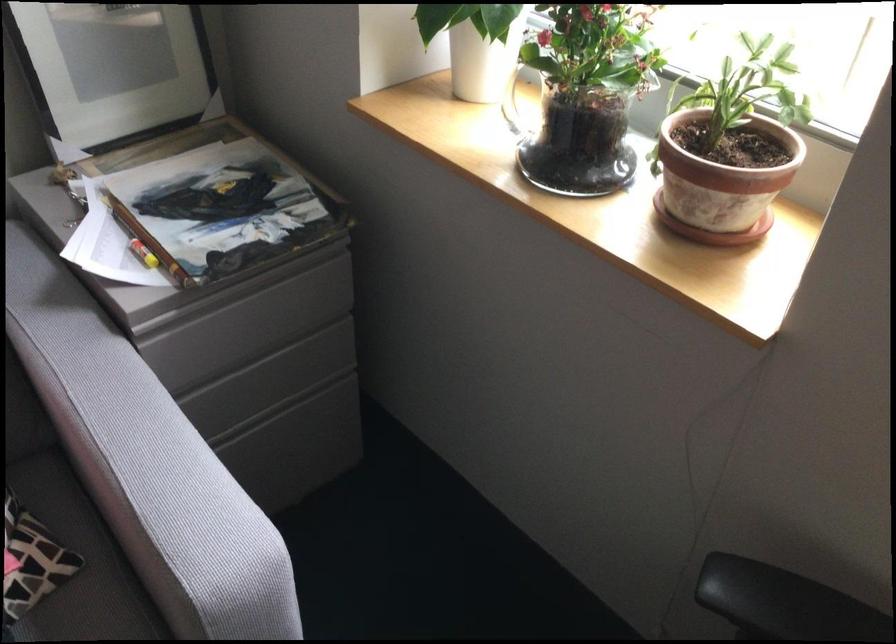
Where is `terracotta flower pot`? This screenshot has height=644, width=896. terracotta flower pot is located at coordinates (721, 184).